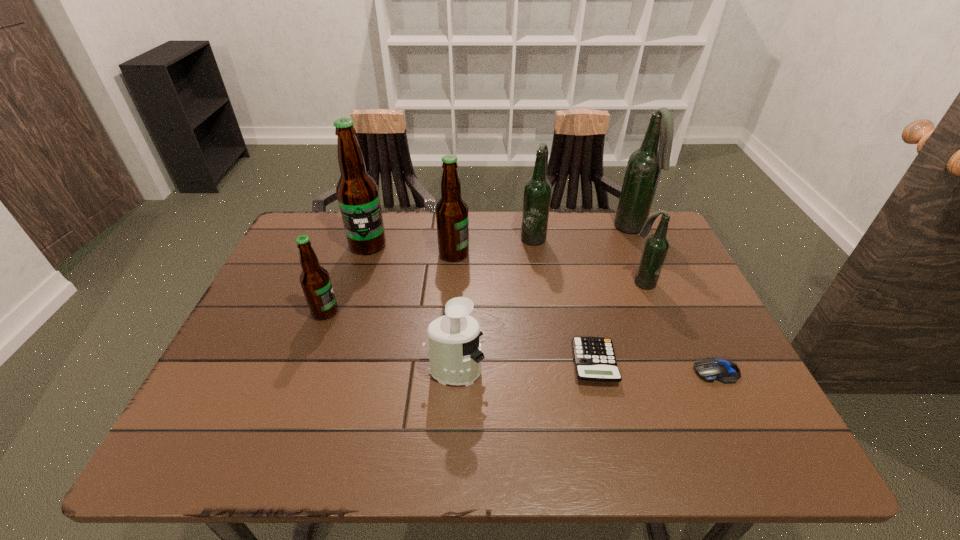
Where is `vacant space at the right edge of the desktop`? vacant space at the right edge of the desktop is located at coordinates coord(699,313).

At what (x,y) coordinates should I click in order to perform the action: click on vacant area at the near right corner. Please return your answer as a coordinate pair (x, y). The height and width of the screenshot is (540, 960). Looking at the image, I should click on tap(721, 433).

Where is `empty space that is in between the smallest dark beer bottle and the second biggest brown beer bottle`? This screenshot has height=540, width=960. empty space that is in between the smallest dark beer bottle and the second biggest brown beer bottle is located at coordinates (548, 268).

Where is `blank region between the leftmost dark beer bottle and the juicer`? Image resolution: width=960 pixels, height=540 pixels. blank region between the leftmost dark beer bottle and the juicer is located at coordinates (494, 304).

This screenshot has width=960, height=540. Identify the location of vacant area that lies between the calculator and the biggest dark beer bottle. (612, 296).

The width and height of the screenshot is (960, 540). Find the location of `unoccupied area between the calculator and the leftmost dark beer bottle`. unoccupied area between the calculator and the leftmost dark beer bottle is located at coordinates pos(564,300).

Identify the location of empty location between the fourth object from right to left and the biggest dark beer bottle. (612, 296).

At what (x,y) coordinates should I click in order to perform the action: click on empty space between the juicer and the leftmost dark beer bottle. Please return your answer as a coordinate pair (x, y). This screenshot has height=540, width=960. Looking at the image, I should click on (494, 304).

The height and width of the screenshot is (540, 960). In order to click on vacant region between the biggest dark beer bottle and the second nearest beer bottle in this screenshot , I will do `click(636, 256)`.

Locate an element on the screen. This screenshot has height=540, width=960. unoccupied area between the juicer and the smallest brown beer bottle is located at coordinates (390, 342).